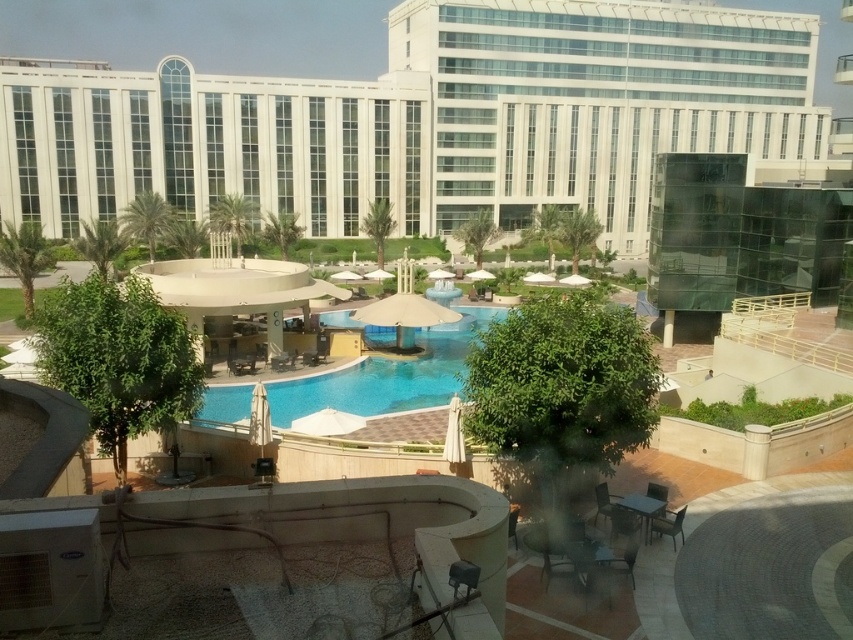
Which is in front, point (392, 372) or point (601, 545)?

Point (601, 545) is in front.

Is blue glossy swimming pool at center positioned in front of metallic silver chair at lower center?

No, blue glossy swimming pool at center is behind metallic silver chair at lower center.

What do you see at coordinates (386, 376) in the screenshot?
I see `blue glossy swimming pool at center` at bounding box center [386, 376].

Locate an element on the screen. This screenshot has height=640, width=853. blue glossy swimming pool at center is located at coordinates (386, 376).

Can you confirm if blue glossy swimming pool at center is positioned below wooden chair at lower right?

Incorrect, blue glossy swimming pool at center is not positioned below wooden chair at lower right.

Measure the distance between point (x=380, y=333) and camera.

142.45 feet

Does point (212, 390) lie behind point (509, 522)?

Yes, it is behind point (509, 522).

The height and width of the screenshot is (640, 853). I want to click on blue glossy swimming pool at center, so click(386, 376).

Which is above, white glass building at upper center or matte black chair at lower center?

white glass building at upper center

Who is taller, white glass building at upper center or matte black chair at lower center?

Standing taller between the two is white glass building at upper center.

The image size is (853, 640). Describe the element at coordinates (431, 120) in the screenshot. I see `white glass building at upper center` at that location.

Find the location of a particular element. This screenshot has height=640, width=853. white glass building at upper center is located at coordinates (431, 120).